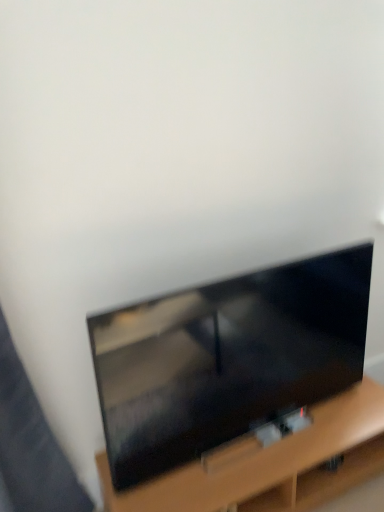
Question: Is point (380, 386) positioned closer to the camera than point (355, 375)?

Choices:
 (A) closer
 (B) farther

Answer: (A)

Question: Is wooden tv stand at lower center bigger or smaller than matte black tv at center?

Choices:
 (A) small
 (B) big

Answer: (B)

Question: From the image's perspective, relative to matte black tv at center, is wooden tv stand at lower center above or below?

Choices:
 (A) above
 (B) below

Answer: (B)

Question: From their relative heights in the image, would you say matte black tv at center is taller or shorter than wooden tv stand at lower center?

Choices:
 (A) short
 (B) tall

Answer: (B)

Question: Considering the positions of matte black tv at center and wooden tv stand at lower center in the image, is matte black tv at center bigger or smaller than wooden tv stand at lower center?

Choices:
 (A) big
 (B) small

Answer: (B)

Question: Is matte black tv at center inside or outside of wooden tv stand at lower center?

Choices:
 (A) inside
 (B) outside

Answer: (B)

Question: Does point (312, 397) appear closer or farther from the camera than point (339, 470)?

Choices:
 (A) farther
 (B) closer

Answer: (A)